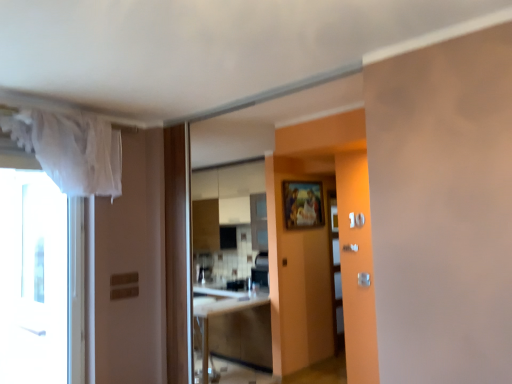
Question: Can white glass window at left be found inside silver metallic door handle at center-right, which ranks as the 1th door handle in back-to-front order?

Choices:
 (A) no
 (B) yes

Answer: (A)

Question: Does silver metallic door handle at center-right, which ranks as the 1th door handle in left-to-right order, turn towards white glass window at left?

Choices:
 (A) yes
 (B) no

Answer: (B)

Question: From a real-world perspective, is silver metallic door handle at center-right, the 2th door handle when ordered from right to left, over white glass window at left?

Choices:
 (A) no
 (B) yes

Answer: (A)

Question: Does silver metallic door handle at center-right, placed as the second door handle when sorted from front to back, lie in front of white glass window at left?

Choices:
 (A) yes
 (B) no

Answer: (B)

Question: Does silver metallic door handle at center-right, which ranks as the 1th door handle in left-to-right order, have a larger size compared to white glass window at left?

Choices:
 (A) yes
 (B) no

Answer: (B)

Question: From the image's perspective, would you say silver metallic door handle at center-right, placed as the second door handle when sorted from front to back, is positioned over white glass window at left?

Choices:
 (A) yes
 (B) no

Answer: (A)

Question: Is white sheer curtain at upper left completely or partially inside satin silver door handle at center right, which ranks as the 1th door handle in right-to-left order?

Choices:
 (A) yes
 (B) no

Answer: (B)

Question: Is satin silver door handle at center right, placed as the second door handle when sorted from left to right, smaller than white sheer curtain at upper left?

Choices:
 (A) yes
 (B) no

Answer: (A)

Question: Is satin silver door handle at center right, placed as the second door handle when sorted from left to right, wider than white sheer curtain at upper left?

Choices:
 (A) yes
 (B) no

Answer: (B)

Question: Is satin silver door handle at center right, which is counted as the 1th door handle, starting from the bottom, facing away from white sheer curtain at upper left?

Choices:
 (A) no
 (B) yes

Answer: (A)

Question: Is satin silver door handle at center right, placed as the second door handle when sorted from left to right, bigger than white sheer curtain at upper left?

Choices:
 (A) yes
 (B) no

Answer: (B)

Question: Is satin silver door handle at center right, marked as the 1th door handle in a front-to-back arrangement, not inside white sheer curtain at upper left?

Choices:
 (A) no
 (B) yes

Answer: (B)

Question: Is the depth of white sheer curtain at upper left less than that of wooden cabinet at center?

Choices:
 (A) no
 (B) yes

Answer: (B)